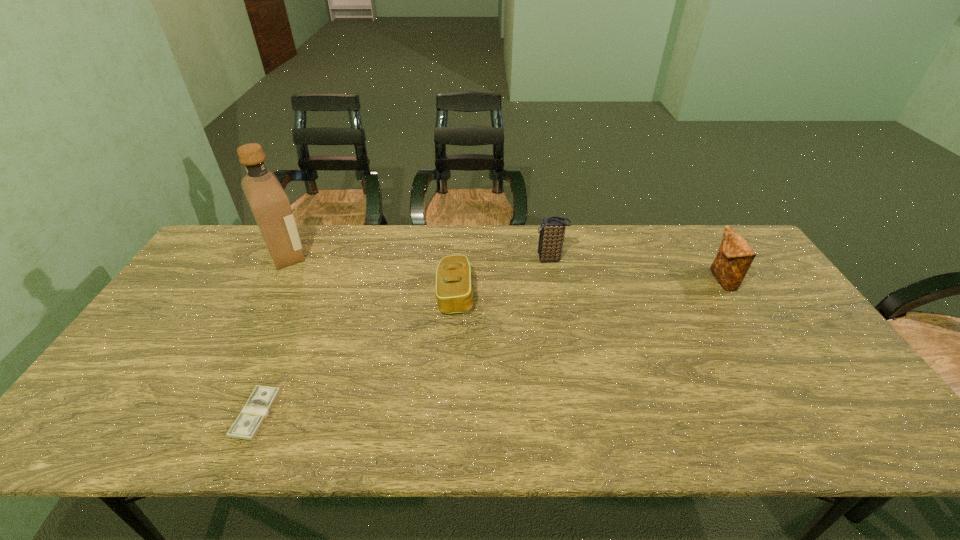
Find the location of a particular element. Image resolution: width=960 pixels, height=540 pixels. the tallest object is located at coordinates (270, 205).

Find the location of a particular element. The height and width of the screenshot is (540, 960). the leftmost object is located at coordinates (270, 205).

You are a GUI agent. You are given a task and a screenshot of the screen. Output one action in this format:
    pyautogui.click(x=<x>, y=<y>)
    Task: Click on the farthest clutch bag
    The height and width of the screenshot is (540, 960).
    Given the screenshot: What is the action you would take?
    pyautogui.click(x=552, y=229)

Find the location of a particular element. the second clutch bag from right to left is located at coordinates (552, 229).

Where is `the rightmost clutch bag`? the rightmost clutch bag is located at coordinates coord(735,256).

At what (x,y) coordinates should I click in order to perform the action: click on the leftmost clutch bag. Please return your answer as a coordinate pair (x, y). The height and width of the screenshot is (540, 960). Looking at the image, I should click on (454, 291).

Locate an element on the screen. The width and height of the screenshot is (960, 540). the third object from right to left is located at coordinates (454, 291).

Locate an element on the screen. dollar is located at coordinates (262, 399).

At what (x,y) coordinates should I click in order to perform the action: click on the fourth object from right to left. Please return your answer as a coordinate pair (x, y). Image resolution: width=960 pixels, height=540 pixels. Looking at the image, I should click on (262, 399).

Locate an element on the screen. free location located 0.280m on the front-facing side of the tallest object is located at coordinates (397, 254).